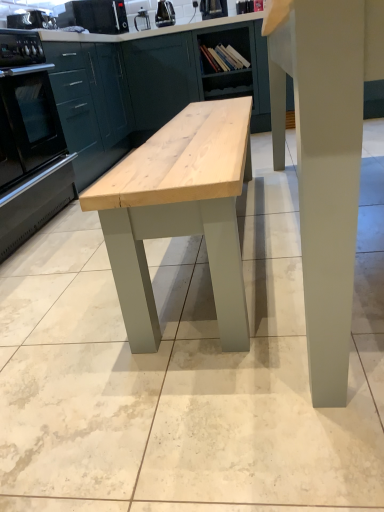
Question: Considering the relative sizes of black plastic toaster at upper left, which ranks as the first appliance in left-to-right order, and metallic silver toaster at upper center, marked as the 4th appliance in a left-to-right arrangement, in the image provided, is black plastic toaster at upper left, which ranks as the first appliance in left-to-right order, thinner than metallic silver toaster at upper center, marked as the 4th appliance in a left-to-right arrangement,?

Choices:
 (A) no
 (B) yes

Answer: (A)

Question: Does black plastic toaster at upper left, positioned as the 4th appliance in right-to-left order, have a greater width compared to metallic silver toaster at upper center, the 1th appliance positioned from the right?

Choices:
 (A) no
 (B) yes

Answer: (B)

Question: Does black plastic toaster at upper left, positioned as the 4th appliance in right-to-left order, have a lesser height compared to metallic silver toaster at upper center, the 1th appliance positioned from the right?

Choices:
 (A) yes
 (B) no

Answer: (A)

Question: Is black plastic toaster at upper left, which ranks as the first appliance in left-to-right order, in front of metallic silver toaster at upper center, marked as the 4th appliance in a left-to-right arrangement?

Choices:
 (A) yes
 (B) no

Answer: (A)

Question: From a real-world perspective, is black plastic toaster at upper left, which ranks as the first appliance in left-to-right order, physically above metallic silver toaster at upper center, the 1th appliance positioned from the right?

Choices:
 (A) yes
 (B) no

Answer: (A)

Question: Relative to black plastic toaster at upper left, the third appliance in the right-to-left sequence, is matte green cabinet at center, which ranks as the 2th cabinetry in left-to-right order, in front or behind?

Choices:
 (A) behind
 (B) front

Answer: (B)

Question: From the image's perspective, is matte green cabinet at center, which is the 2th cabinetry in right-to-left order, positioned above or below black plastic toaster at upper left, which appears as the 2th appliance when viewed from the left?

Choices:
 (A) above
 (B) below

Answer: (B)

Question: Would you say matte green cabinet at center, which ranks as the 2th cabinetry in left-to-right order, is inside or outside black plastic toaster at upper left, which appears as the 2th appliance when viewed from the left?

Choices:
 (A) outside
 (B) inside

Answer: (A)

Question: Visually, is matte green cabinet at center, which ranks as the 2th cabinetry in left-to-right order, positioned to the left or to the right of black plastic toaster at upper left, the third appliance in the right-to-left sequence?

Choices:
 (A) right
 (B) left

Answer: (A)

Question: From a real-world perspective, is metallic silver toaster at upper center, marked as the 4th appliance in a left-to-right arrangement, physically located above or below matte green cabinetry at left, marked as the first cabinetry in a left-to-right arrangement?

Choices:
 (A) above
 (B) below

Answer: (A)

Question: Is metallic silver toaster at upper center, marked as the 4th appliance in a left-to-right arrangement, to the left or to the right of matte green cabinetry at left, positioned as the 3th cabinetry in right-to-left order, in the image?

Choices:
 (A) right
 (B) left

Answer: (A)

Question: Looking at the image, does metallic silver toaster at upper center, the 1th appliance positioned from the right, seem bigger or smaller compared to matte green cabinetry at left, positioned as the 3th cabinetry in right-to-left order?

Choices:
 (A) small
 (B) big

Answer: (A)

Question: From the image's perspective, is metallic silver toaster at upper center, the 1th appliance positioned from the right, above or below matte green cabinetry at left, positioned as the 3th cabinetry in right-to-left order?

Choices:
 (A) below
 (B) above

Answer: (B)

Question: Is satin black oven at left inside or outside of black plastic kettle at upper center, positioned as the 3th appliance in left-to-right order?

Choices:
 (A) inside
 (B) outside

Answer: (B)

Question: From the image's perspective, relative to black plastic kettle at upper center, positioned as the 3th appliance in left-to-right order, is satin black oven at left above or below?

Choices:
 (A) above
 (B) below

Answer: (B)